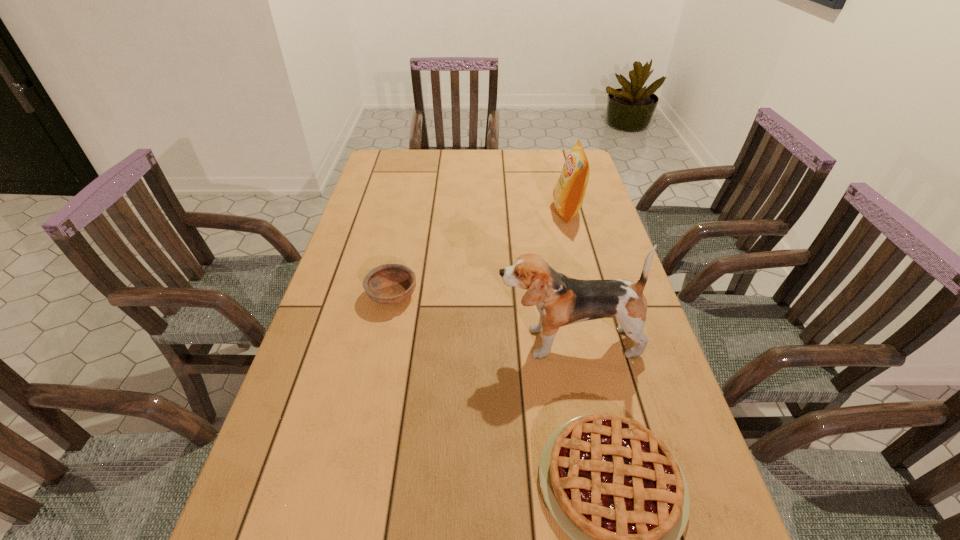
Find the location of `blank space at the far right corner of the desktop`. blank space at the far right corner of the desktop is located at coordinates (559, 156).

At what (x,y) coordinates should I click in order to perform the action: click on free space that is in between the bowl and the crisp (potato chip). Please return your answer as a coordinate pair (x, y). The width and height of the screenshot is (960, 540). Looking at the image, I should click on (480, 253).

This screenshot has width=960, height=540. In order to click on vacant area that lies between the bowl and the crisp (potato chip) in this screenshot , I will do `click(480, 253)`.

Select which object appears as the third closest to the bowl. Please provide its 2D coordinates. Your answer should be formatted as a tuple, i.e. [(x, y)], where the tuple contains the x and y coordinates of a point satisfying the conditions above.

[(568, 195)]

Where is `the second closest object to the puppy`? This screenshot has height=540, width=960. the second closest object to the puppy is located at coordinates (389, 284).